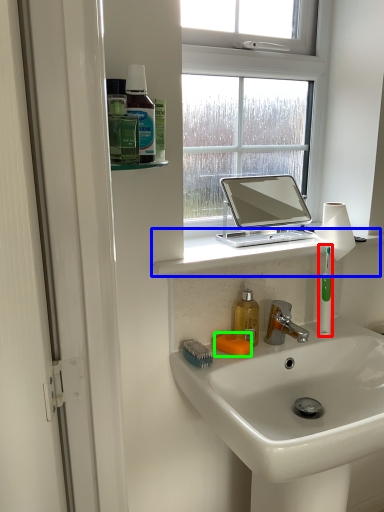
Question: Which object is the closest to the toothbrush (highlighted by a red box)? Choose among these: window sill (highlighted by a blue box) or soap (highlighted by a green box).

Choices:
 (A) window sill
 (B) soap

Answer: (A)